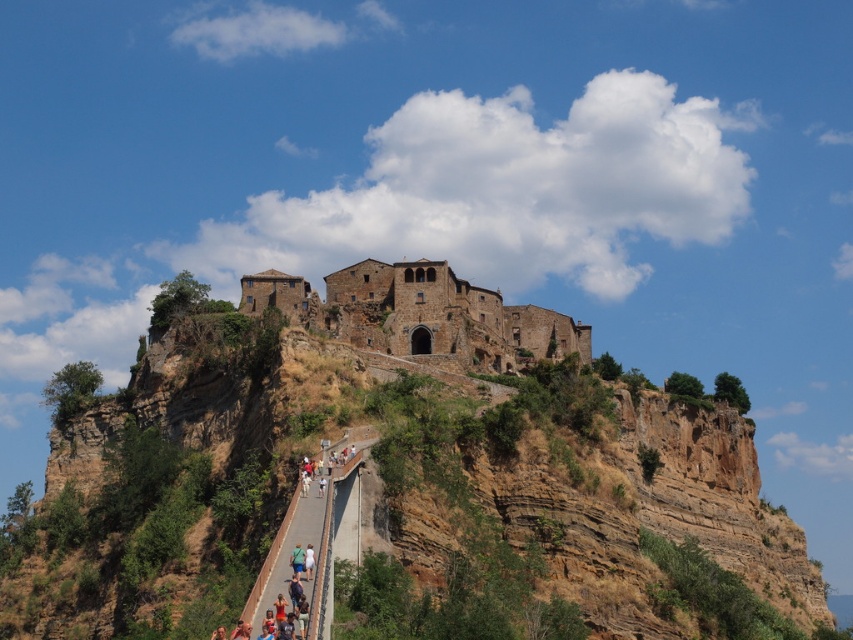
Can you confirm if brown stone building at center is bigger than concrete walkway at center?

Yes, brown stone building at center is bigger than concrete walkway at center.

Is brown stone building at center shorter than concrete walkway at center?

No.

Describe the element at coordinates (421, 314) in the screenshot. The height and width of the screenshot is (640, 853). I see `brown stone building at center` at that location.

Where is `brown stone building at center`? The height and width of the screenshot is (640, 853). brown stone building at center is located at coordinates tap(421, 314).

Does concrete walkway at center appear on the left side of green fabric person at lower center?

Yes, concrete walkway at center is to the left of green fabric person at lower center.

Is point (276, 538) positioned in front of point (310, 550)?

No, (276, 538) is further to viewer.

Identify the location of concrete walkway at center. The height and width of the screenshot is (640, 853). (271, 557).

Does light blue denim shorts at lower center appear under green fabric person at lower center?

No.

I want to click on light blue denim shorts at lower center, so click(297, 560).

The image size is (853, 640). What are the coordinates of `light blue denim shorts at lower center` in the screenshot? It's located at (297, 560).